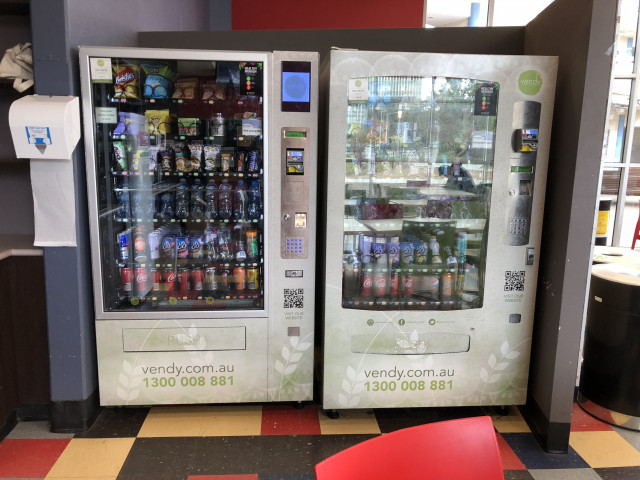
The height and width of the screenshot is (480, 640). In order to click on paper towel dispenser in this screenshot , I will do `click(56, 118)`.